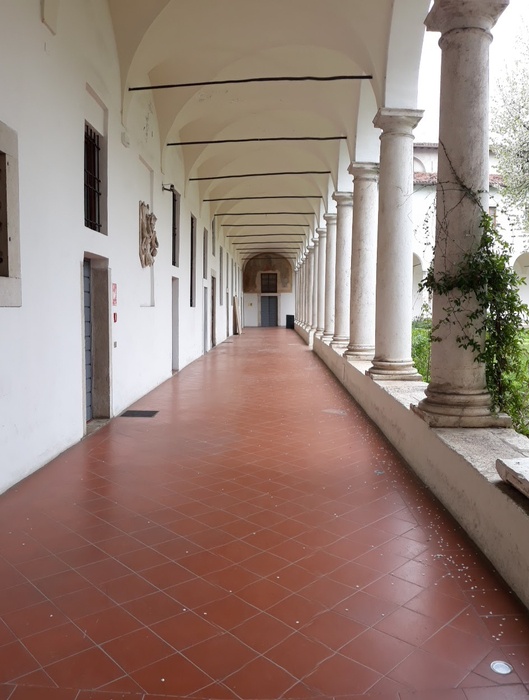
Locate an element on the screen. wall is located at coordinates (65, 371).